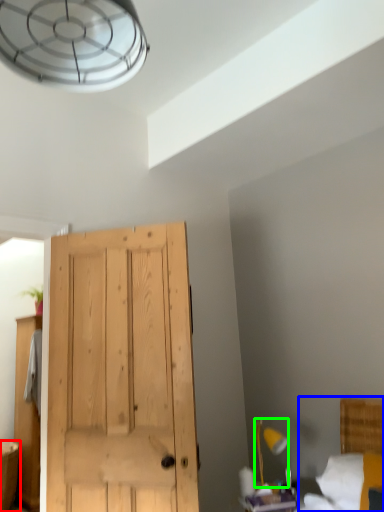
Question: Estimate the real-world distances between objects in this image. Which object is farther from vanity (highlighted by a red box), bed (highlighted by a blue box) or light fixture (highlighted by a green box)?

Choices:
 (A) bed
 (B) light fixture

Answer: (A)